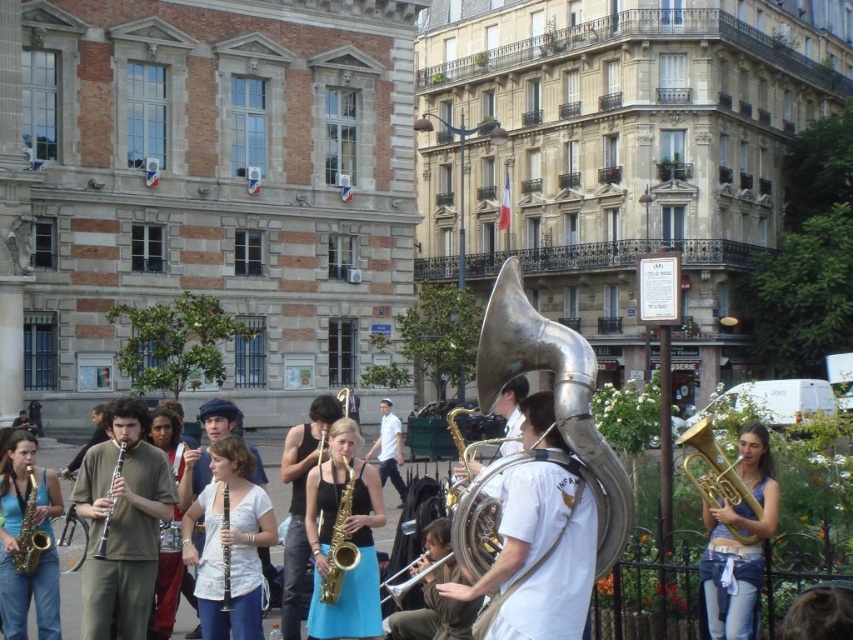
Question: Which point is closer to the camera taking this photo?

Choices:
 (A) (332, 435)
 (B) (225, 563)
 (C) (106, 416)
 (D) (405, 588)

Answer: (D)

Question: Which object is the closest to the gold brass trumpet at lower right?

Choices:
 (A) gold saxophone at lower left
 (B) silver metallic bass horn at center

Answer: (B)

Question: Among these points, which one is nearest to the camera?

Choices:
 (A) (22, 500)
 (B) (604, 474)

Answer: (B)

Question: Can you confirm if matte green clarinet at center is smaller than silver metallic flute at center?

Choices:
 (A) no
 (B) yes

Answer: (B)

Question: Is brushed metal saxophone at lower left positioned behind white matte shirt at center?

Choices:
 (A) yes
 (B) no

Answer: (B)

Question: Observing the image, what is the correct spatial positioning of gold saxophone at lower left in reference to matte gold clarinet at center?

Choices:
 (A) below
 (B) above

Answer: (A)